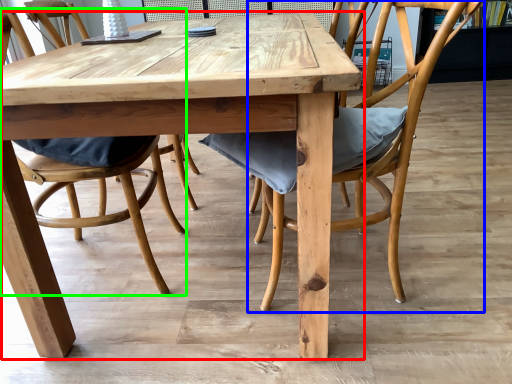
Question: Based on their relative distances, which object is nearer to kitchen & dining room table (highlighted by a red box)? Choose from chair (highlighted by a blue box) and chair (highlighted by a green box).

Choices:
 (A) chair
 (B) chair

Answer: (A)